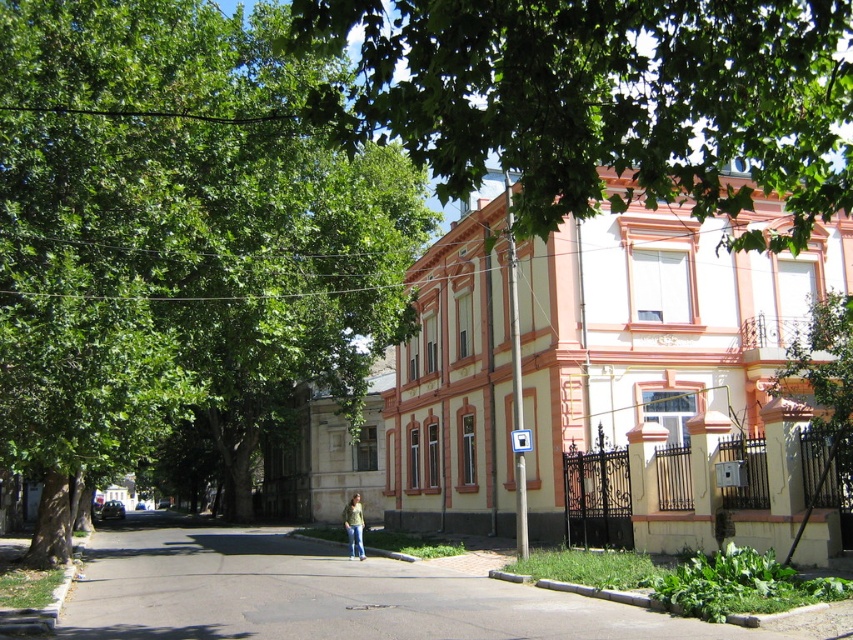
Question: Can you confirm if green leafy tree at upper center is positioned below jeans at center?

Choices:
 (A) yes
 (B) no

Answer: (B)

Question: Does green leafy tree at upper center lie behind jeans at center?

Choices:
 (A) yes
 (B) no

Answer: (B)

Question: Which object is positioned farthest from the green leafy tree at upper center?

Choices:
 (A) green leafy tree at center
 (B) jeans at center

Answer: (B)

Question: Is green leafy tree at center wider than green leafy tree at upper center?

Choices:
 (A) yes
 (B) no

Answer: (B)

Question: Among these objects, which one is farthest from the camera?

Choices:
 (A) jeans at center
 (B) green leafy tree at upper center

Answer: (A)

Question: Which point is farther to the camera?

Choices:
 (A) (346, 509)
 (B) (317, 74)
 (C) (444, 189)

Answer: (A)